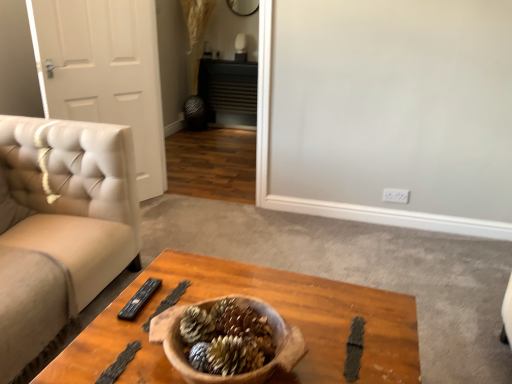
The height and width of the screenshot is (384, 512). Describe the element at coordinates (139, 299) in the screenshot. I see `black plastic remote at center` at that location.

Find the location of `black plastic remote at center`. black plastic remote at center is located at coordinates (139, 299).

Which is correct: white leather door at left is inside wooden coffee table at center, or outside of it?

white leather door at left is spatially situated outside wooden coffee table at center.

From a real-world perspective, is white leather door at left positioned over wooden coffee table at center based on gravity?

Correct, in the physical world, white leather door at left is higher than wooden coffee table at center.

Considering the positions of objects white leather door at left and wooden coffee table at center in the image provided, who is in front, white leather door at left or wooden coffee table at center?

wooden coffee table at center is more forward.

I want to click on remote on the left of wooden coffee table at center, so click(x=139, y=299).

Does wooden coffee table at center appear on the right side of black plastic remote at center?

Correct, you'll find wooden coffee table at center to the right of black plastic remote at center.

From a real-world perspective, between wooden coffee table at center and black plastic remote at center, who is vertically higher?

In real-world perspective, black plastic remote at center is above.

Is wooden coffee table at center facing towards black plastic remote at center?

No, wooden coffee table at center does not turn towards black plastic remote at center.

From the image's perspective, is white leather door at left above black plastic remote at center?

Yes, from the image's perspective, white leather door at left is over black plastic remote at center.

Which object is closer to the camera taking this photo, white leather door at left or black plastic remote at center?

black plastic remote at center is closer to the camera.

The image size is (512, 384). I want to click on remote below the white leather door at left (from a real-world perspective), so [x=139, y=299].

Are white leather door at left and black plastic remote at center far apart?

Yes.

Does black plastic remote at center appear on the right side of wooden coffee table at center?

No, black plastic remote at center is not to the right of wooden coffee table at center.

Is black plastic remote at center taller than wooden coffee table at center?

No.

From a real-world perspective, who is located higher, black plastic remote at center or wooden coffee table at center?

In real-world perspective, black plastic remote at center is above.

Is black plastic remote at center surrounding wooden coffee table at center?

No, wooden coffee table at center is located outside of black plastic remote at center.

The image size is (512, 384). Find the location of `door behind the black plastic remote at center`. door behind the black plastic remote at center is located at coordinates (104, 73).

Does black plastic remote at center contain white leather door at left?

That's incorrect, white leather door at left is not inside black plastic remote at center.

Considering the sizes of objects black plastic remote at center and white leather door at left in the image provided, who is shorter, black plastic remote at center or white leather door at left?

With less height is black plastic remote at center.

Is wooden coffee table at center taller or shorter than white leather door at left?

Clearly, wooden coffee table at center is shorter compared to white leather door at left.

I want to click on coffee table in front of the white leather door at left, so click(272, 306).

Which is correct: wooden coffee table at center is inside white leather door at left, or outside of it?

The correct answer is: outside.

Where is `door above the wooden coffee table at center (from a real-world perspective)`? door above the wooden coffee table at center (from a real-world perspective) is located at coordinates (104, 73).

Find the location of a particular element. This screenshot has height=384, width=512. coffee table in front of the black plastic remote at center is located at coordinates (272, 306).

From the image, which object appears to be nearer to wooden coffee table at center, black plastic remote at center or white leather door at left?

black plastic remote at center.

Looking at the image, which one is located further to white leather door at left, wooden coffee table at center or black plastic remote at center?

The object further to white leather door at left is black plastic remote at center.

When comparing their distances from black plastic remote at center, does white leather door at left or wooden coffee table at center seem further?

Among the two, white leather door at left is located further to black plastic remote at center.

Estimate the real-world distances between objects in this image. Which object is further from white leather door at left, black plastic remote at center or wooden coffee table at center?

Based on the image, black plastic remote at center appears to be further to white leather door at left.

Considering their positions, is white leather door at left positioned closer to wooden coffee table at center than black plastic remote at center?

Based on the image, black plastic remote at center appears to be nearer to wooden coffee table at center.

From the image, which object appears to be nearer to black plastic remote at center, wooden coffee table at center or white leather door at left?

Among the two, wooden coffee table at center is located nearer to black plastic remote at center.

You are a GUI agent. You are given a task and a screenshot of the screen. Output one action in this format:
    pyautogui.click(x=<x>, y=<y>)
    Task: Click on the remote between wooden coffee table at center and white leather door at left along the z-axis
    This screenshot has width=512, height=384.
    Given the screenshot: What is the action you would take?
    pyautogui.click(x=139, y=299)